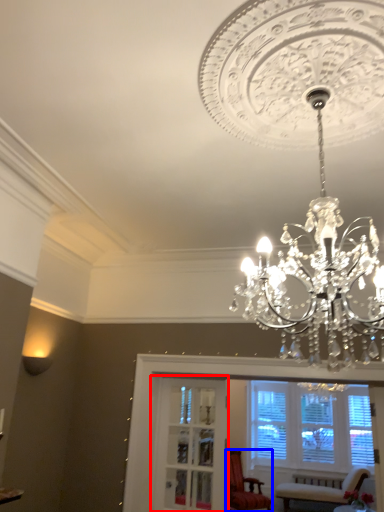
Question: Which of the following is the farthest to the observer, glass door (highlighted by a red box) or chair (highlighted by a blue box)?

Choices:
 (A) glass door
 (B) chair

Answer: (B)